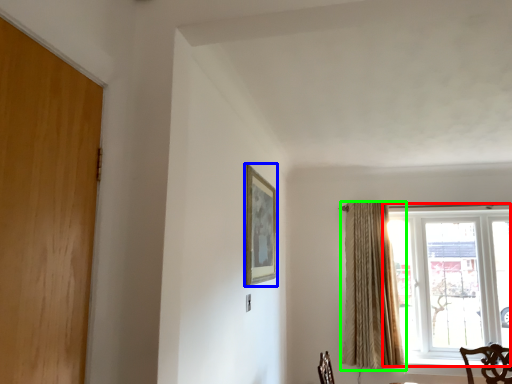
Question: Based on their relative distances, which object is nearer to window (highlighted by a red box)? Choose from picture frame (highlighted by a blue box) and curtain (highlighted by a green box).

Choices:
 (A) picture frame
 (B) curtain

Answer: (B)